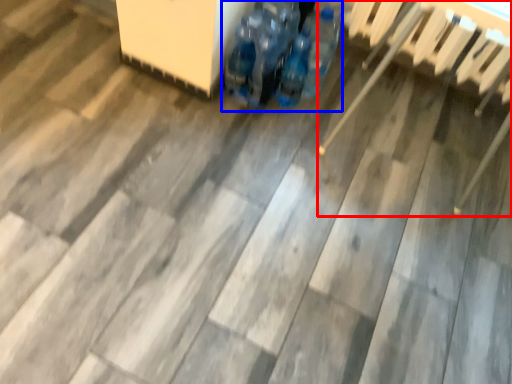
Question: Which of the following is the closest to the observer, chair (highlighted by a red box) or footwear (highlighted by a blue box)?

Choices:
 (A) chair
 (B) footwear

Answer: (A)